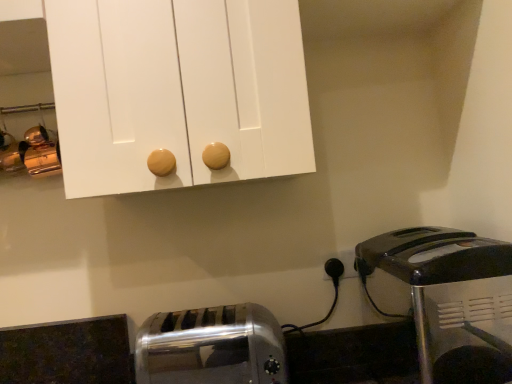
Question: From a real-world perspective, is black plastic toaster at lower right, arranged as the first toaster when viewed from the right, located higher than satin silver toaster at lower left, which appears as the first toaster when viewed from the left?

Choices:
 (A) no
 (B) yes

Answer: (B)

Question: Does black plastic toaster at lower right, the second toaster from the left, have a greater height compared to satin silver toaster at lower left, which appears as the first toaster when viewed from the left?

Choices:
 (A) no
 (B) yes

Answer: (B)

Question: Is satin silver toaster at lower left, which appears as the first toaster when viewed from the left, located within black plastic toaster at lower right, the second toaster from the left?

Choices:
 (A) no
 (B) yes

Answer: (A)

Question: Is black plastic toaster at lower right, arranged as the first toaster when viewed from the right, behind satin silver toaster at lower left, which appears as the first toaster when viewed from the left?

Choices:
 (A) no
 (B) yes

Answer: (A)

Question: Can you confirm if black plastic toaster at lower right, arranged as the first toaster when viewed from the right, is shorter than satin silver toaster at lower left, which appears as the first toaster when viewed from the left?

Choices:
 (A) no
 (B) yes

Answer: (A)

Question: Does black plastic toaster at lower right, arranged as the first toaster when viewed from the right, appear on the left side of satin silver toaster at lower left, which appears as the first toaster when viewed from the left?

Choices:
 (A) no
 (B) yes

Answer: (A)

Question: Does satin silver toaster at lower left, the second toaster in the right-to-left sequence, have a lesser width compared to black plastic toaster at lower right, the second toaster from the left?

Choices:
 (A) no
 (B) yes

Answer: (B)

Question: Does satin silver toaster at lower left, which appears as the first toaster when viewed from the left, have a greater width compared to black plastic toaster at lower right, the second toaster from the left?

Choices:
 (A) yes
 (B) no

Answer: (B)

Question: Could you tell me if satin silver toaster at lower left, which appears as the first toaster when viewed from the left, is turned towards black plastic toaster at lower right, arranged as the first toaster when viewed from the right?

Choices:
 (A) yes
 (B) no

Answer: (B)

Question: Is the surface of satin silver toaster at lower left, the second toaster in the right-to-left sequence, in direct contact with black plastic toaster at lower right, arranged as the first toaster when viewed from the right?

Choices:
 (A) no
 (B) yes

Answer: (A)

Question: From the image's perspective, would you say satin silver toaster at lower left, the second toaster in the right-to-left sequence, is positioned over black plastic toaster at lower right, arranged as the first toaster when viewed from the right?

Choices:
 (A) yes
 (B) no

Answer: (B)

Question: Is black plastic toaster at lower right, the second toaster from the left, at the back of satin silver toaster at lower left, which appears as the first toaster when viewed from the left?

Choices:
 (A) no
 (B) yes

Answer: (A)

Question: From the image's perspective, is satin silver toaster at lower left, the second toaster in the right-to-left sequence, located above or below black plastic toaster at lower right, the second toaster from the left?

Choices:
 (A) above
 (B) below

Answer: (B)